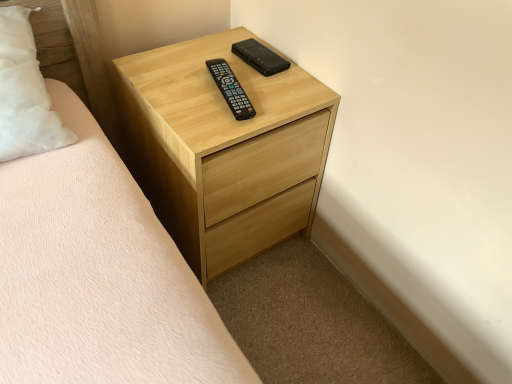
Locate an element on the screen. vacant space that is in between black plastic remote at center, the first control in the bottom-to-top sequence, and black matte phone at upper center, which is the 2th control in front-to-back order is located at coordinates (259, 87).